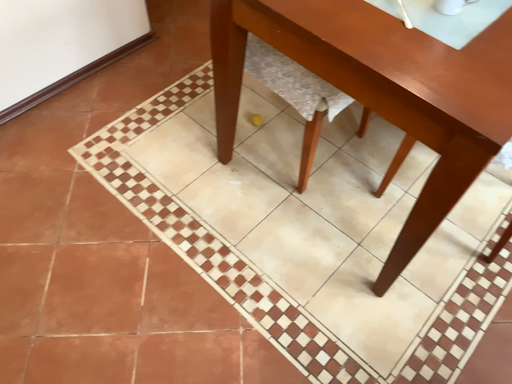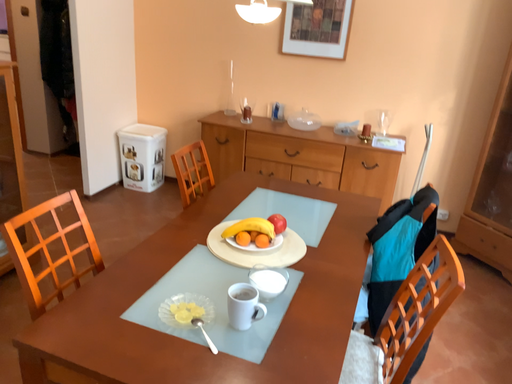
Question: How did the camera likely rotate when shooting the video?

Choices:
 (A) rotated downward
 (B) rotated upward

Answer: (B)